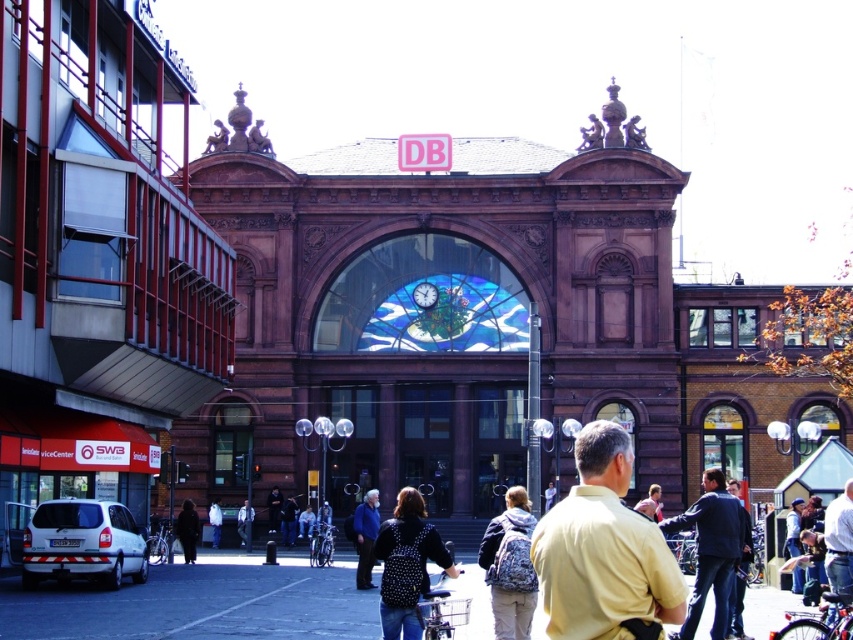
The height and width of the screenshot is (640, 853). In order to click on polka dot backpack at center in this screenshot , I will do `click(407, 564)`.

Based on the photo, which is more to the right, polka dot backpack at center or blue denim jacket at center?

From the viewer's perspective, polka dot backpack at center appears more on the right side.

Where is `polka dot backpack at center`? Image resolution: width=853 pixels, height=640 pixels. polka dot backpack at center is located at coordinates (407, 564).

Where is `polka dot backpack at center`? This screenshot has width=853, height=640. polka dot backpack at center is located at coordinates (407, 564).

Does polka dot backpack at center appear under fluffy fabric backpack at center?

Yes, polka dot backpack at center is below fluffy fabric backpack at center.

How far apart are polka dot backpack at center and fluffy fabric backpack at center?

The distance of polka dot backpack at center from fluffy fabric backpack at center is 5.40 meters.

Locate an element on the screen. The image size is (853, 640). polka dot backpack at center is located at coordinates (407, 564).

This screenshot has width=853, height=640. I want to click on polka dot backpack at center, so click(x=407, y=564).

Which is in front, point (186, 545) or point (424, 304)?

Point (186, 545) is more forward.

Who is higher up, black wool coat at lower left or metallic blue clock at center?

Positioned higher is metallic blue clock at center.

Image resolution: width=853 pixels, height=640 pixels. I want to click on black wool coat at lower left, so click(x=187, y=531).

Find the location of `black wool coat at lower left`. black wool coat at lower left is located at coordinates (187, 531).